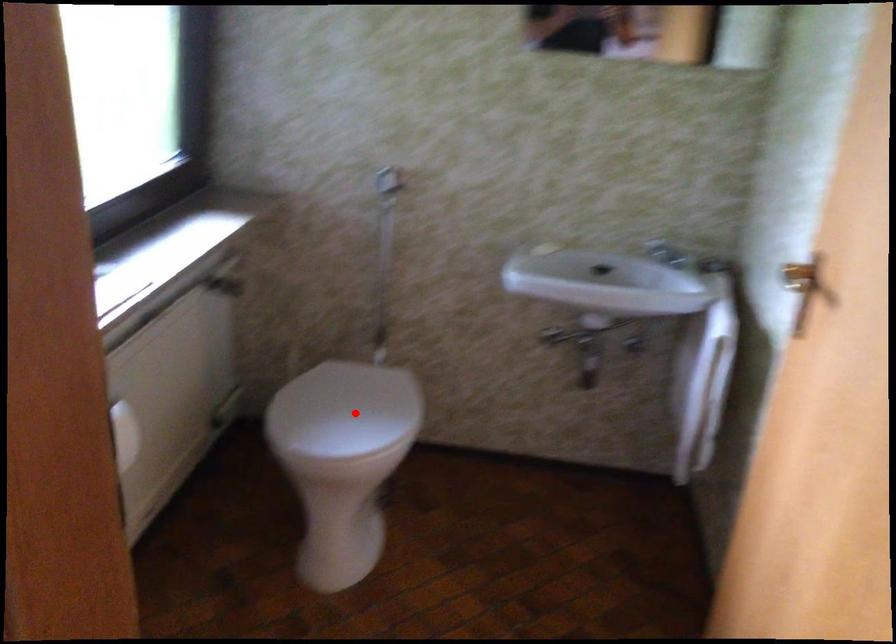
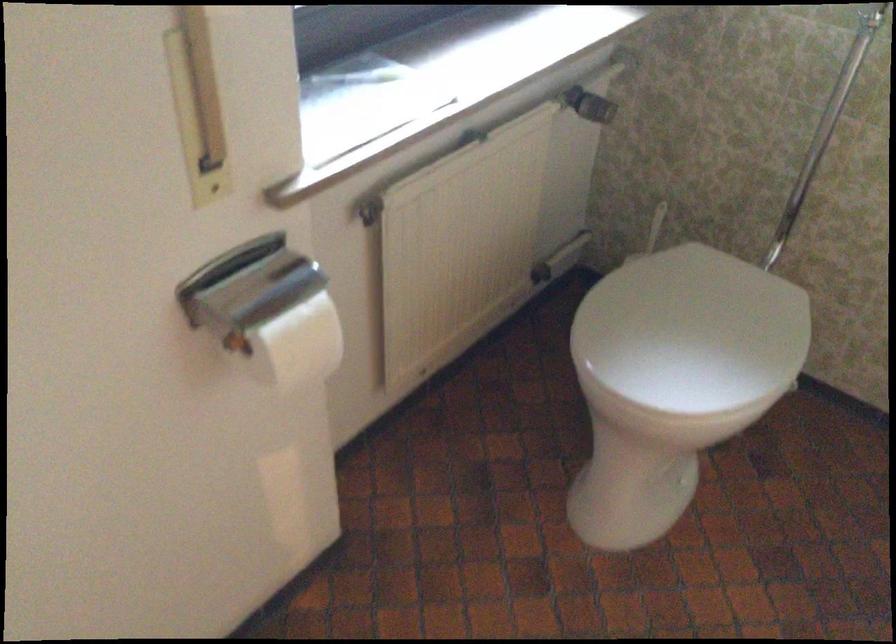
The point at the highlighted location is marked in the first image. Where is the corresponding point in the second image?

(692, 330)